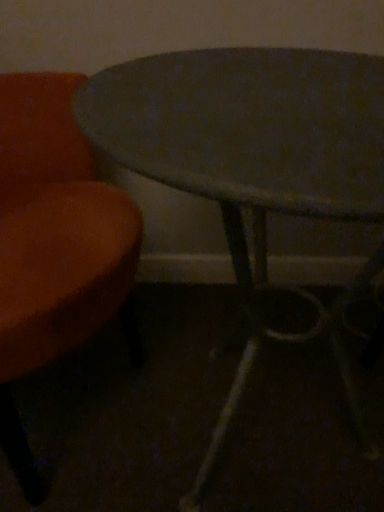
Locate an element on the screen. The width and height of the screenshot is (384, 512). velvet orange chair at left is located at coordinates (55, 246).

Image resolution: width=384 pixels, height=512 pixels. What do you see at coordinates (55, 246) in the screenshot? I see `velvet orange chair at left` at bounding box center [55, 246].

Measure the distance between point (x=55, y=332) and camera.

The distance of point (x=55, y=332) from camera is 24.76 inches.

What do you see at coordinates (253, 161) in the screenshot? The height and width of the screenshot is (512, 384). I see `metallic gray table at center` at bounding box center [253, 161].

Find the location of `metallic gray table at center`. metallic gray table at center is located at coordinates (253, 161).

Where is `velvet orange chair at left`? velvet orange chair at left is located at coordinates (55, 246).

Looking at this image, is velvet orange chair at left at the right side of metallic gray table at center?

In fact, velvet orange chair at left is to the left of metallic gray table at center.

Is the position of velvet orange chair at left less distant than that of metallic gray table at center?

Yes, velvet orange chair at left is closer to the camera.

Considering the positions of point (97, 325) and point (270, 151), is point (97, 325) closer or farther from the camera than point (270, 151)?

Clearly, point (97, 325) is more distant from the camera than point (270, 151).

From the image's perspective, is velvet orange chair at left positioned above or below metallic gray table at center?

Clearly, from the image's perspective, velvet orange chair at left is above metallic gray table at center.

From a real-world perspective, is velvet orange chair at left on metallic gray table at center?

Yes.

In terms of width, does velvet orange chair at left look wider or thinner when compared to metallic gray table at center?

Clearly, velvet orange chair at left has more width compared to metallic gray table at center.

Does velvet orange chair at left have a greater height compared to metallic gray table at center?

Correct, velvet orange chair at left is much taller as metallic gray table at center.

Can you confirm if velvet orange chair at left is bigger than metallic gray table at center?

Indeed, velvet orange chair at left has a larger size compared to metallic gray table at center.

Is metallic gray table at center completely or partially inside velvet orange chair at left?

That's incorrect, metallic gray table at center is not inside velvet orange chair at left.

Would you say velvet orange chair at left is a long distance from metallic gray table at center?

No, there isn't a large distance between velvet orange chair at left and metallic gray table at center.

Is velvet orange chair at left aimed at metallic gray table at center?

Yes, velvet orange chair at left is oriented towards metallic gray table at center.

How different are the orientations of velvet orange chair at left and metallic gray table at center in degrees?

The facing directions of velvet orange chair at left and metallic gray table at center are 59.2 degrees apart.

You are a GUI agent. You are given a task and a screenshot of the screen. Output one action in this format:
    pyautogui.click(x=<x>, y=<y>)
    Task: Click on the chair above the metallic gray table at center (from a real-world perspective)
    The height and width of the screenshot is (512, 384).
    Given the screenshot: What is the action you would take?
    pyautogui.click(x=55, y=246)

In the scene shown: Is metallic gray table at center to the right of velvet orange chair at left from the viewer's perspective?

Indeed, metallic gray table at center is positioned on the right side of velvet orange chair at left.

In the image, is metallic gray table at center positioned in front of or behind velvet orange chair at left?

metallic gray table at center is positioned farther from the viewer than velvet orange chair at left.

Considering the points (159, 181) and (5, 349), which point is in front, point (159, 181) or point (5, 349)?

The point (159, 181) is in front.

From the image's perspective, is metallic gray table at center over velvet orange chair at left?

No, from the image's perspective, metallic gray table at center is not over velvet orange chair at left.

From a real-world perspective, which is physically below, metallic gray table at center or velvet orange chair at left?

From a 3D spatial view, metallic gray table at center is below.

Looking at this image, which object is wider, metallic gray table at center or velvet orange chair at left?

With larger width is velvet orange chair at left.

Between metallic gray table at center and velvet orange chair at left, which one has less height?

metallic gray table at center is shorter.

Does metallic gray table at center have a larger size compared to velvet orange chair at left?

No.

Would you say metallic gray table at center is outside velvet orange chair at left?

Yes, metallic gray table at center is not within velvet orange chair at left.

Is metallic gray table at center positioned far away from velvet orange chair at left?

metallic gray table at center is actually quite close to velvet orange chair at left.

Is metallic gray table at center looking in the opposite direction of velvet orange chair at left?

No, metallic gray table at center's orientation is not away from velvet orange chair at left.

Can you tell me how much metallic gray table at center and velvet orange chair at left differ in facing direction?

The angular difference between metallic gray table at center and velvet orange chair at left is 59.2 degrees.

Where is `chair above the metallic gray table at center (from the image's perspective)`? The height and width of the screenshot is (512, 384). chair above the metallic gray table at center (from the image's perspective) is located at coordinates (55, 246).

Locate an element on the screen. The height and width of the screenshot is (512, 384). chair above the metallic gray table at center (from a real-world perspective) is located at coordinates (55, 246).

What are the coordinates of `chair located on the left of metallic gray table at center` in the screenshot? It's located at click(55, 246).